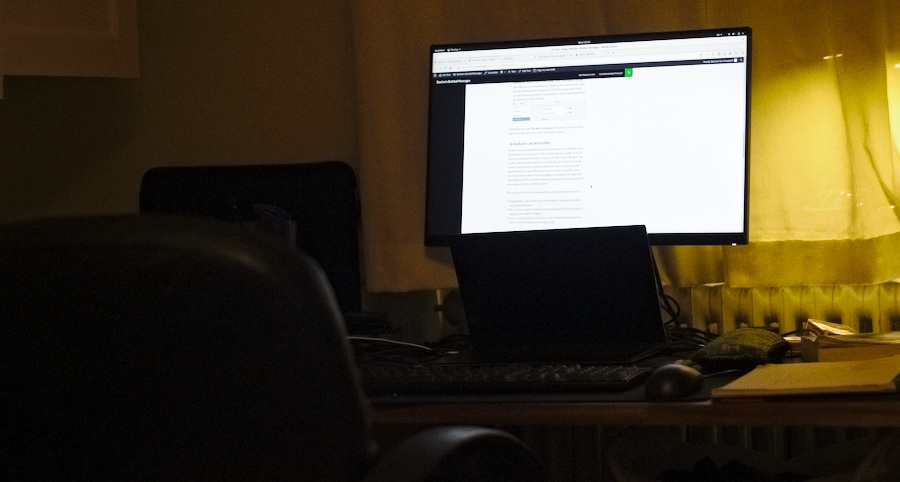
Locate an element on the screen. The height and width of the screenshot is (482, 900). picture frame is located at coordinates (104, 58).